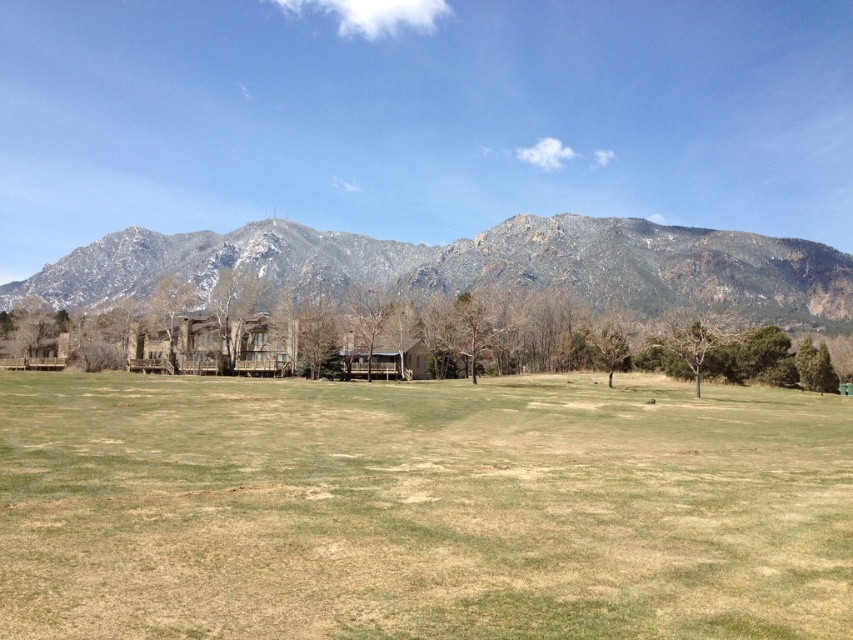
Is rocky gray mountain range at upper center above brown textured tree at center?

Yes.

Which of these two, rocky gray mountain range at upper center or brown textured tree at center, stands shorter?

With less height is brown textured tree at center.

Who is more distant from viewer, (801, 256) or (596, 346)?

Answer: The point (801, 256) is more distant.

Image resolution: width=853 pixels, height=640 pixels. I want to click on rocky gray mountain range at upper center, so click(x=479, y=266).

Which is below, rocky gray mountain range at upper center or green leafy tree at center?

green leafy tree at center

Which of these two, rocky gray mountain range at upper center or green leafy tree at center, stands shorter?

green leafy tree at center

Find the location of a particular element. This screenshot has width=853, height=640. rocky gray mountain range at upper center is located at coordinates (479, 266).

You are a GUI agent. You are given a task and a screenshot of the screen. Output one action in this format:
    pyautogui.click(x=<x>, y=<y>)
    Task: Click on the rocky gray mountain range at upper center
    The width and height of the screenshot is (853, 640).
    Given the screenshot: What is the action you would take?
    pyautogui.click(x=479, y=266)

Who is taller, rocky gray mountain range at upper center or wooden cabin at center?

rocky gray mountain range at upper center is taller.

Where is `rocky gray mountain range at upper center`? The width and height of the screenshot is (853, 640). rocky gray mountain range at upper center is located at coordinates (479, 266).

Find the location of a particular element. rocky gray mountain range at upper center is located at coordinates (479, 266).